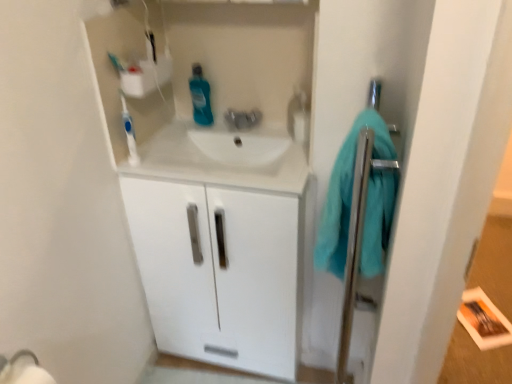
This screenshot has height=384, width=512. I want to click on vacant location behind white plastic toothbrush at upper left, so click(x=146, y=148).